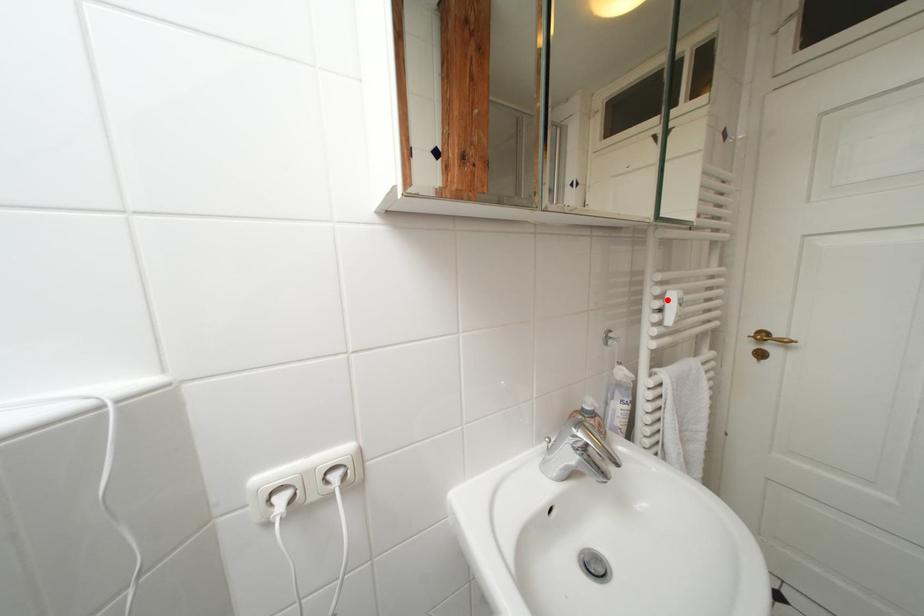
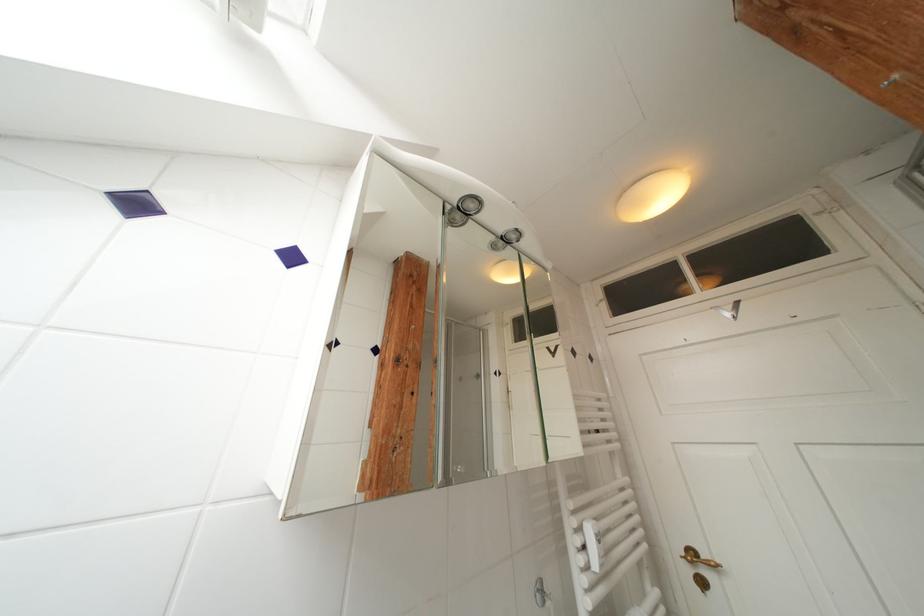
Where in the second image is the point corresponding to the highlighted location from the first image?

(586, 533)